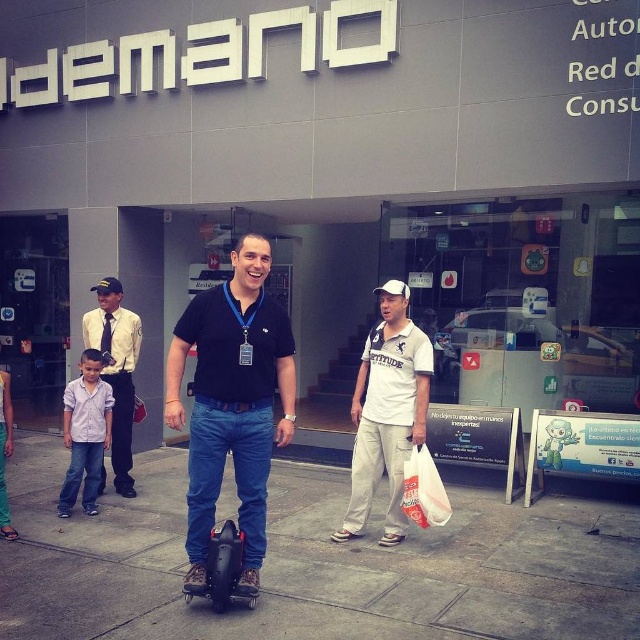
You are standing at the entrance of the store and want to walk towards the point labeled as point (118, 333). Which direction should you go relative to the point labeled as point (244, 241)?

Result: Since point (244, 241) is in front of point (118, 333), you should walk behind the point labeled as point (244, 241) to reach point (118, 333).

You are a delivery person who needs to place a package on the concrete at center and the purple cotton shirt at lower left. Which surface can accommodate a wider package?

The purple cotton shirt at lower left has a greater width than the concrete at center, so it can accommodate a wider package.